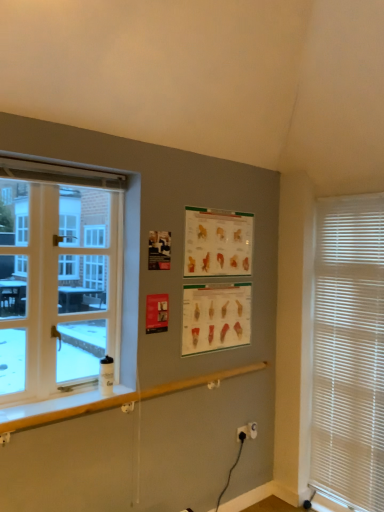
This screenshot has width=384, height=512. I want to click on white plastic electric outlet at lower center, acting as the 3th electric outlet starting from the left, so 252,430.

Locate an element on the screen. The width and height of the screenshot is (384, 512). matte paper poster at center, which is the 1th poster page from bottom to top is located at coordinates (215, 317).

Measure the distance between white wood window sill at lower left and camera.

white wood window sill at lower left is 1.76 meters from camera.

What are the coordinates of `matte paper poster at upper center, acting as the first poster page starting from the top` in the screenshot? It's located at (217, 242).

At what (x,y) coordinates should I click in order to perform the action: click on white glass window at left. Please return your answer as a coordinate pair (x, y). Image resolution: width=384 pixels, height=512 pixels. Looking at the image, I should click on (58, 280).

Does white glass window at left touch matte paper poster at upper center, acting as the first poster page starting from the top?

No, white glass window at left is not in contact with matte paper poster at upper center, acting as the first poster page starting from the top.

Considering the sizes of white glass window at left and matte paper poster at upper center, which is the second poster page in bottom-to-top order, in the image, is white glass window at left bigger or smaller than matte paper poster at upper center, which is the second poster page in bottom-to-top order,?

white glass window at left is bigger than matte paper poster at upper center, which is the second poster page in bottom-to-top order.

What's the angular difference between white glass window at left and matte paper poster at upper center, which is the second poster page in bottom-to-top order,'s facing directions?

0.0274 degrees.

At what (x,y) coordinates should I click in order to perform the action: click on window directly beneath the matte paper poster at upper center, acting as the first poster page starting from the top (from a real-world perspective). Please return your answer as a coordinate pair (x, y). The image size is (384, 512). Looking at the image, I should click on (58, 280).

Considering the sizes of matte paper poster at upper center, which is the second poster page in bottom-to-top order, and matte paper poster at center, which is the 2th poster page in top-to-bottom order, in the image, is matte paper poster at upper center, which is the second poster page in bottom-to-top order, wider or thinner than matte paper poster at center, which is the 2th poster page in top-to-bottom order,?

Considering their sizes, matte paper poster at upper center, which is the second poster page in bottom-to-top order, looks slimmer than matte paper poster at center, which is the 2th poster page in top-to-bottom order.

Does matte paper poster at upper center, which is the second poster page in bottom-to-top order, lie in front of matte paper poster at center, which is the 1th poster page from bottom to top?

Yes, matte paper poster at upper center, which is the second poster page in bottom-to-top order, is in front of matte paper poster at center, which is the 1th poster page from bottom to top.

Is point (252, 214) farther from viewer compared to point (220, 311)?

Yes, point (252, 214) is farther from viewer.

Is matte paper poster at upper center, acting as the first poster page starting from the top, oriented away from matte paper poster at center, which is the 1th poster page from bottom to top?

No, matte paper poster at center, which is the 1th poster page from bottom to top, is not at the back of matte paper poster at upper center, acting as the first poster page starting from the top.

Considering the positions of objects white wood window sill at lower left and white plastic electric outlet at lower center, the first electric outlet from the right, in the image provided, who is behind, white wood window sill at lower left or white plastic electric outlet at lower center, the first electric outlet from the right,?

white plastic electric outlet at lower center, the first electric outlet from the right, is behind.

In terms of width, does white wood window sill at lower left look wider or thinner when compared to white plastic electric outlet at lower center, the first electric outlet from the right?

Clearly, white wood window sill at lower left has more width compared to white plastic electric outlet at lower center, the first electric outlet from the right.

Which of these two, white wood window sill at lower left or white plastic electric outlet at lower center, the first electric outlet from the right, stands shorter?

white wood window sill at lower left.

Looking at this image, are white wood window sill at lower left and white plastic electric outlet at lower center, acting as the 3th electric outlet starting from the left, located far from each other?

white wood window sill at lower left is positioned a significant distance from white plastic electric outlet at lower center, acting as the 3th electric outlet starting from the left.

From a real-world perspective, is black plastic electric outlet at lower center, which is the 1th electric outlet from left to right, positioned above or below black plastic electric outlet at lower right, the second electric outlet from the right?

In terms of real-world spatial position, black plastic electric outlet at lower center, which is the 1th electric outlet from left to right, is below black plastic electric outlet at lower right, the second electric outlet from the right.

What's the angular difference between black plastic electric outlet at lower center, the 3th electric outlet viewed from the right, and black plastic electric outlet at lower right, acting as the second electric outlet starting from the left,'s facing directions?

0.00877 degrees.

Consider the image. Considering the positions of objects black plastic electric outlet at lower center, the 3th electric outlet viewed from the right, and black plastic electric outlet at lower right, the second electric outlet from the right, in the image provided, who is more to the right, black plastic electric outlet at lower center, the 3th electric outlet viewed from the right, or black plastic electric outlet at lower right, the second electric outlet from the right,?

Positioned to the right is black plastic electric outlet at lower right, the second electric outlet from the right.

Consider the image. Is black plastic electric outlet at lower center, the 3th electric outlet viewed from the right, shorter than black plastic electric outlet at lower right, acting as the second electric outlet starting from the left?

Indeed, black plastic electric outlet at lower center, the 3th electric outlet viewed from the right, has a lesser height compared to black plastic electric outlet at lower right, acting as the second electric outlet starting from the left.

Could you tell me if black plastic electric outlet at lower center, which is the 1th electric outlet from left to right, is facing white plastic electric outlet at lower center, acting as the 3th electric outlet starting from the left?

No, black plastic electric outlet at lower center, which is the 1th electric outlet from left to right, is not facing towards white plastic electric outlet at lower center, acting as the 3th electric outlet starting from the left.

Considering the positions of points (241, 426) and (255, 426), is point (241, 426) farther from camera compared to point (255, 426)?

No, it is in front of (255, 426).

From the image's perspective, does black plastic electric outlet at lower center, which is the 1th electric outlet from left to right, appear higher than white plastic electric outlet at lower center, acting as the 3th electric outlet starting from the left?

Actually, black plastic electric outlet at lower center, which is the 1th electric outlet from left to right, appears below white plastic electric outlet at lower center, acting as the 3th electric outlet starting from the left, in the image.

Is black plastic electric outlet at lower right, acting as the second electric outlet starting from the left, positioned with its back to white glass window at left?

No, black plastic electric outlet at lower right, acting as the second electric outlet starting from the left, is not facing the opposite direction of white glass window at left.

From the image's perspective, is black plastic electric outlet at lower right, acting as the second electric outlet starting from the left, on top of white glass window at left?

No, from the image's perspective, black plastic electric outlet at lower right, acting as the second electric outlet starting from the left, is not on top of white glass window at left.

In the scene shown: Considering the sizes of objects black plastic electric outlet at lower right, acting as the second electric outlet starting from the left, and white glass window at left in the image provided, who is taller, black plastic electric outlet at lower right, acting as the second electric outlet starting from the left, or white glass window at left?

Standing taller between the two is white glass window at left.

Considering their positions, is black plastic electric outlet at lower right, the second electric outlet from the right, located in front of or behind white glass window at left?

Clearly, black plastic electric outlet at lower right, the second electric outlet from the right, is behind white glass window at left.

Can you confirm if black plastic electric outlet at lower center, which is the 1th electric outlet from left to right, is shorter than matte paper poster at upper center, acting as the first poster page starting from the top?

Indeed, black plastic electric outlet at lower center, which is the 1th electric outlet from left to right, has a lesser height compared to matte paper poster at upper center, acting as the first poster page starting from the top.

From a real-world perspective, which electric outlet is the 3rd one underneath the matte paper poster at upper center, acting as the first poster page starting from the top? Please provide its 2D coordinates.

[(243, 432)]

What's the angular difference between black plastic electric outlet at lower center, the 3th electric outlet viewed from the right, and matte paper poster at upper center, which is the second poster page in bottom-to-top order,'s facing directions?

0.974 degrees separate the facing orientations of black plastic electric outlet at lower center, the 3th electric outlet viewed from the right, and matte paper poster at upper center, which is the second poster page in bottom-to-top order.

Which is closer to the camera, (245, 426) or (202, 228)?

Positioned in front is point (202, 228).

Where is `window that is in front of the matte paper poster at upper center, acting as the first poster page starting from the top`? The image size is (384, 512). window that is in front of the matte paper poster at upper center, acting as the first poster page starting from the top is located at coordinates (58, 280).

Identify the location of poster page lying on the left of matte paper poster at upper center, which is the second poster page in bottom-to-top order. (215, 317).

When comparing their distances from matte paper poster at center, which is the 2th poster page in top-to-bottom order, does white wood window sill at lower left or white plastic electric outlet at lower center, acting as the 3th electric outlet starting from the left, seem further?

Based on the image, white plastic electric outlet at lower center, acting as the 3th electric outlet starting from the left, appears to be further to matte paper poster at center, which is the 2th poster page in top-to-bottom order.

Looking at the image, which one is located closer to black plastic electric outlet at lower right, the second electric outlet from the right, matte paper poster at center, which is the 1th poster page from bottom to top, or black plastic electric outlet at lower center, the 3th electric outlet viewed from the right?

Among the two, black plastic electric outlet at lower center, the 3th electric outlet viewed from the right, is located nearer to black plastic electric outlet at lower right, the second electric outlet from the right.

When comparing their distances from white plastic electric outlet at lower center, acting as the 3th electric outlet starting from the left, does white textured blinds at right or white wood window sill at lower left seem further?

Among the two, white wood window sill at lower left is located further to white plastic electric outlet at lower center, acting as the 3th electric outlet starting from the left.

Which object lies further to the anchor point black plastic electric outlet at lower center, which is the 1th electric outlet from left to right, white textured blinds at right or matte paper poster at upper center, which is the second poster page in bottom-to-top order?

The object further to black plastic electric outlet at lower center, which is the 1th electric outlet from left to right, is matte paper poster at upper center, which is the second poster page in bottom-to-top order.

From the image, which object appears to be nearer to white wood window sill at lower left, black plastic electric outlet at lower right, the second electric outlet from the right, or matte paper poster at upper center, acting as the first poster page starting from the top?

The object closer to white wood window sill at lower left is matte paper poster at upper center, acting as the first poster page starting from the top.

When comparing their distances from matte paper poster at upper center, which is the second poster page in bottom-to-top order, does white textured blinds at right or white glass window at left seem closer?

Among the two, white glass window at left is located nearer to matte paper poster at upper center, which is the second poster page in bottom-to-top order.

From the image, which object appears to be nearer to white textured blinds at right, black plastic electric outlet at lower center, which is the 1th electric outlet from left to right, or white plastic electric outlet at lower center, the first electric outlet from the right?

white plastic electric outlet at lower center, the first electric outlet from the right.

In the scene shown: Based on their spatial positions, is white plastic electric outlet at lower center, the first electric outlet from the right, or white wood window sill at lower left closer to black plastic electric outlet at lower center, the 3th electric outlet viewed from the right?

white plastic electric outlet at lower center, the first electric outlet from the right, lies closer to black plastic electric outlet at lower center, the 3th electric outlet viewed from the right, than the other object.

I want to click on electric outlet between black plastic electric outlet at lower right, the second electric outlet from the right, and white textured blinds at right, so click(x=252, y=430).

Locate an element on the screen. The image size is (384, 512). electric outlet between matte paper poster at upper center, which is the second poster page in bottom-to-top order, and black plastic electric outlet at lower right, acting as the second electric outlet starting from the left, in the vertical direction is located at coordinates (252, 430).

Find the location of a particular element. This screenshot has width=384, height=512. window between matte paper poster at upper center, which is the second poster page in bottom-to-top order, and white plastic electric outlet at lower center, acting as the 3th electric outlet starting from the left, vertically is located at coordinates (58, 280).

This screenshot has width=384, height=512. What are the coordinates of `window that lies between matte paper poster at upper center, acting as the first poster page starting from the top, and black plastic electric outlet at lower center, which is the 1th electric outlet from left to right, from top to bottom` in the screenshot? It's located at (58, 280).